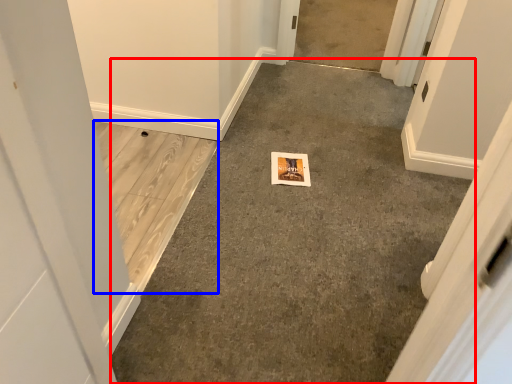
Question: Which point is closer to the camera, concrete (highlighted by a red box) or concrete (highlighted by a blue box)?

Choices:
 (A) concrete
 (B) concrete

Answer: (A)